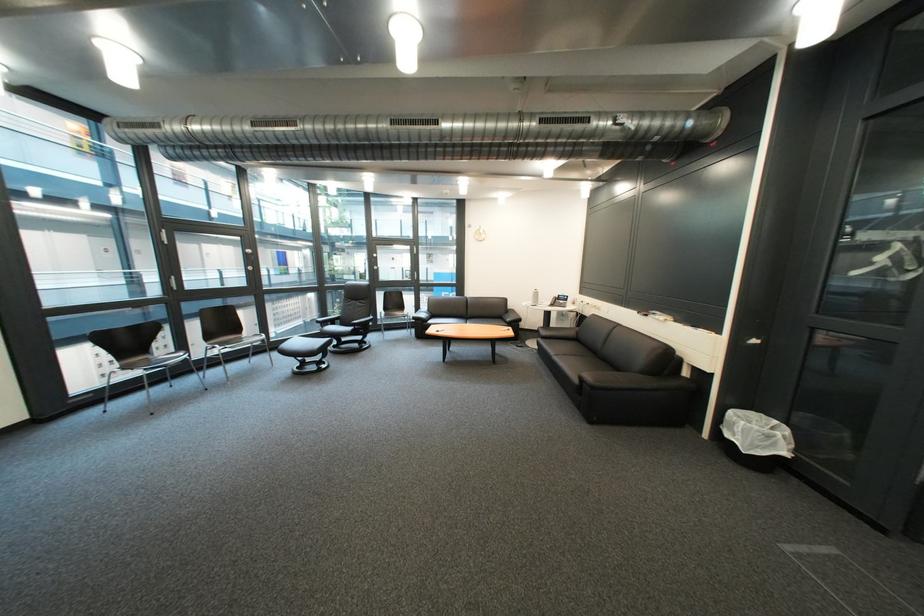
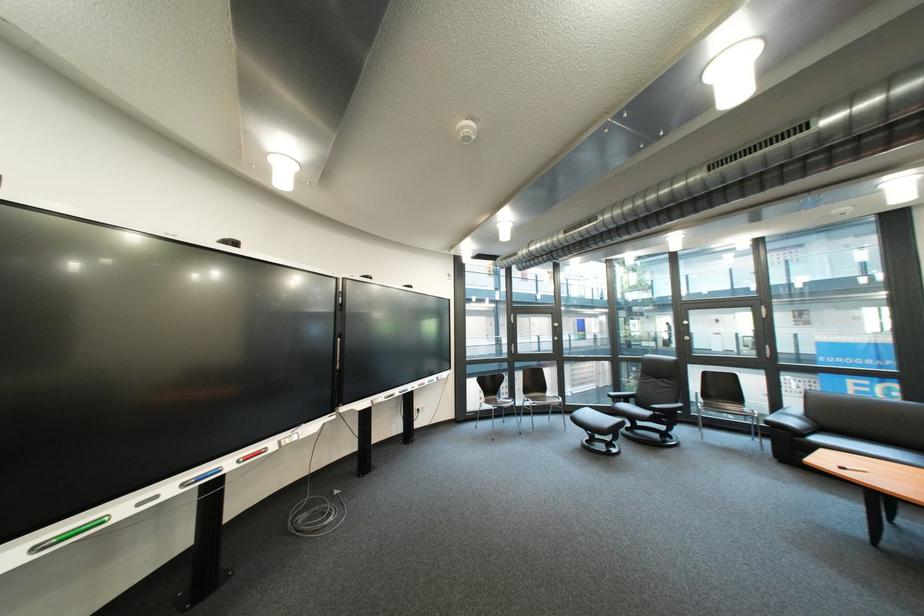
Locate, in the second image, the point that corresponds to (341,318) in the first image.

(634, 392)